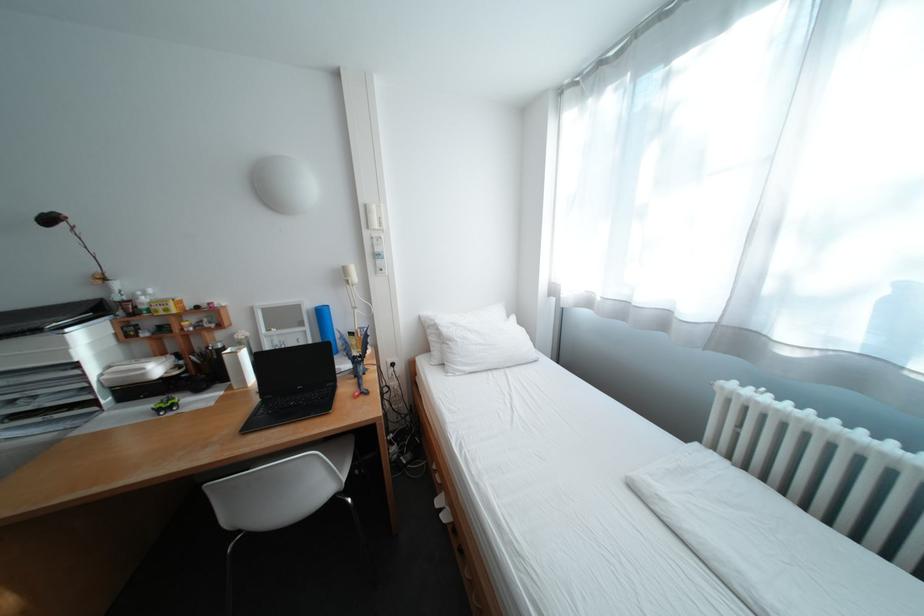
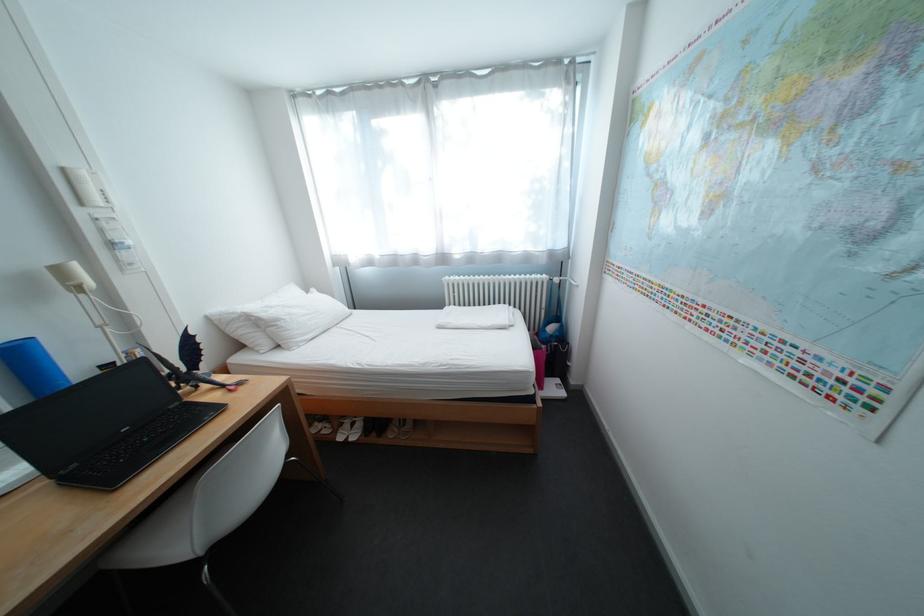
The point at (331,309) is marked in the first image. Where is the corresponding point in the second image?

(17, 347)